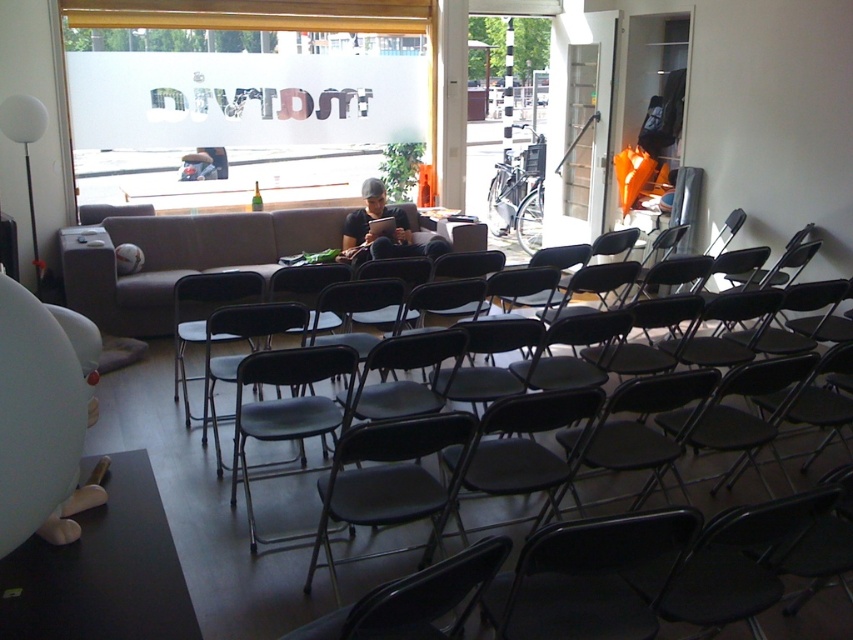
Measure the distance between point (287, 328) and camera.

Point (287, 328) is 3.44 meters from camera.

Which of these two, matte black chair at center or matte black laptop at center, stands taller?

Standing taller between the two is matte black chair at center.

Who is more distant from viewer, (218,323) or (370,228)?

The point (370,228) is more distant.

Where is `matte black chair at center`? This screenshot has width=853, height=640. matte black chair at center is located at coordinates tap(241, 355).

Does black metal chair at center appear under matte black laptop at center?

Indeed, black metal chair at center is positioned under matte black laptop at center.

Is black metal chair at center thinner than matte black laptop at center?

In fact, black metal chair at center might be wider than matte black laptop at center.

Who is more forward, (195, 417) or (399, 221)?

Point (195, 417)

Where is `black metal chair at center`? This screenshot has height=640, width=853. black metal chair at center is located at coordinates (x=689, y=323).

Between point (254, 332) and point (173, 381), which one is positioned in front?

Point (254, 332)

Measure the distance between point (206,419) and camera.

Point (206,419) and camera are 3.79 meters apart from each other.

The image size is (853, 640). I want to click on matte black chair at center, so click(x=241, y=355).